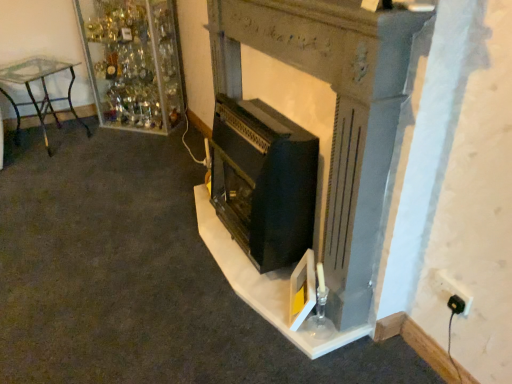
Question: Is black plastic plug at lower right thinner than white plastic plug at lower right?

Choices:
 (A) yes
 (B) no

Answer: (A)

Question: From a real-world perspective, is black plastic plug at lower right positioned over white plastic plug at lower right based on gravity?

Choices:
 (A) yes
 (B) no

Answer: (B)

Question: Is black plastic plug at lower right at the right side of white plastic plug at lower right?

Choices:
 (A) yes
 (B) no

Answer: (B)

Question: From a real-world perspective, is black plastic plug at lower right below white plastic plug at lower right?

Choices:
 (A) no
 (B) yes

Answer: (B)

Question: Are black plastic plug at lower right and white plastic plug at lower right making contact?

Choices:
 (A) yes
 (B) no

Answer: (A)

Question: Considering the positions of point (441, 286) and point (56, 99), is point (441, 286) closer or farther from the camera than point (56, 99)?

Choices:
 (A) farther
 (B) closer

Answer: (B)

Question: Is white plastic plug at lower right bigger or smaller than clear glass table at left?

Choices:
 (A) big
 (B) small

Answer: (B)

Question: Is white plastic plug at lower right in front of or behind clear glass table at left in the image?

Choices:
 (A) behind
 (B) front

Answer: (B)

Question: Is white plastic plug at lower right inside or outside of clear glass table at left?

Choices:
 (A) outside
 (B) inside

Answer: (A)

Question: Is matte black fireplace at center inside or outside of white plastic plug at lower right?

Choices:
 (A) inside
 (B) outside

Answer: (B)

Question: From the image's perspective, is matte black fireplace at center above or below white plastic plug at lower right?

Choices:
 (A) below
 (B) above

Answer: (B)

Question: From their relative heights in the image, would you say matte black fireplace at center is taller or shorter than white plastic plug at lower right?

Choices:
 (A) tall
 (B) short

Answer: (A)

Question: Considering the positions of point (376, 124) and point (465, 299), is point (376, 124) closer or farther from the camera than point (465, 299)?

Choices:
 (A) farther
 (B) closer

Answer: (B)

Question: Considering the relative positions of matte black fireplace at center and black matte wood burning stove at center in the image provided, is matte black fireplace at center to the left or to the right of black matte wood burning stove at center?

Choices:
 (A) left
 (B) right

Answer: (B)

Question: Is matte black fireplace at center wider or thinner than black matte wood burning stove at center?

Choices:
 (A) thin
 (B) wide

Answer: (A)